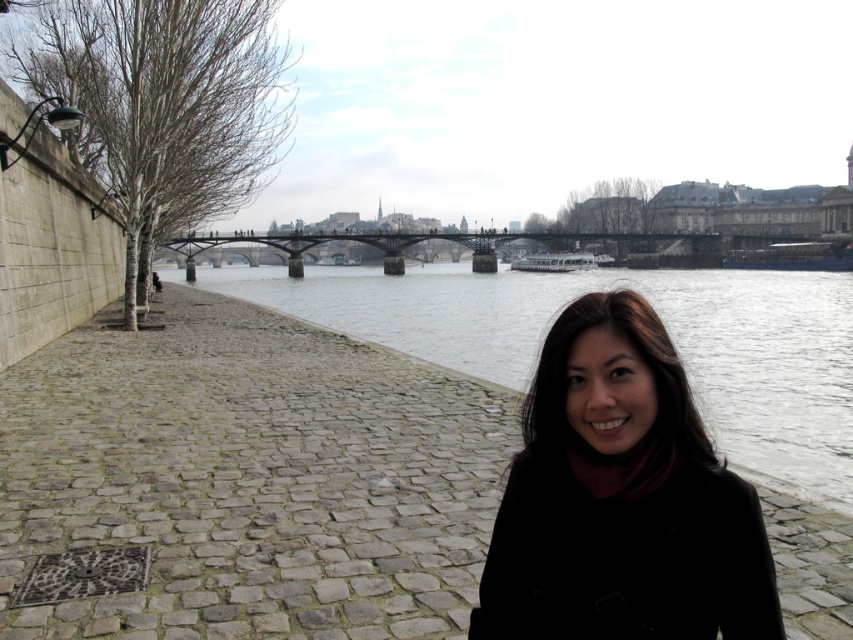
You are a photographer planning to take a photo of the black woolen coat at center and the gray concrete river at center. Based on the scene, which object is closer to the camera?

The black woolen coat at center is closer to the camera since it is in front of the gray concrete river at center.

Based on the photo, you are a photographer planning to capture the black woolen coat at center and the gray concrete river at center in a single shot. Based on the scene description, which object should you focus on first to ensure both are in sharp focus?

The black woolen coat at center is below the gray concrete river at center, so you should focus on the gray concrete river at center first since it is farther away and focusing on it will ensure the coat is also in focus due to depth of field principles.

You are standing at the riverside and see the black woolen coat at center and the metallic bridge at center. Which object is nearer to you?

The black woolen coat at center is closer to the viewer than the metallic bridge at center.